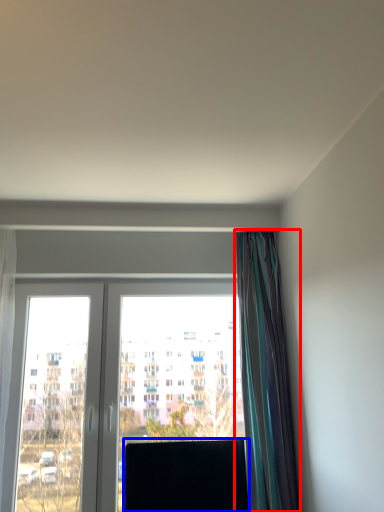
Question: Which object is closer to the camera taking this photo, curtain (highlighted by a red box) or window screen (highlighted by a blue box)?

Choices:
 (A) curtain
 (B) window screen

Answer: (A)